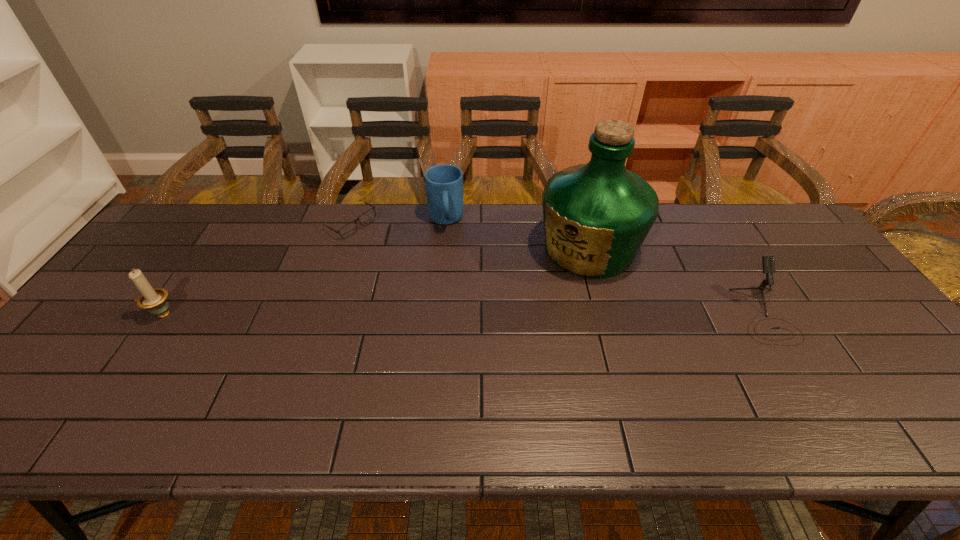
Locate an element on the screen. This screenshot has width=960, height=540. vacant space on the desktop that is between the leftmost object and the second shortest object and is positioned on the side of the third object from right to left with the handle is located at coordinates click(x=452, y=314).

Locate an element on the screen. The image size is (960, 540). free spot on the desktop that is between the leftmost object and the second shortest object and is positioned on the label side of the liquor is located at coordinates (516, 314).

Find the location of a particular element. The width and height of the screenshot is (960, 540). vacant space on the desktop that is between the candle_holder and the microphone and is positioned with the lenses facing outward on the shortest object is located at coordinates (375, 314).